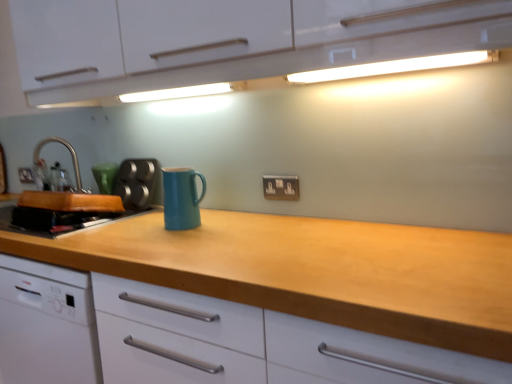
Measure the distance between matte silver electric outlet at center and camera.

4.98 feet.

What is the approximate height of brushed metal tap at left?

brushed metal tap at left is 29.10 centimeters tall.

Image resolution: width=512 pixels, height=384 pixels. Describe the element at coordinates (136, 182) in the screenshot. I see `metallic silver muffin tin at left` at that location.

This screenshot has height=384, width=512. I want to click on white glossy cabinet at upper center, so click(233, 41).

Considering the positions of objects teal matte mug at center, which is the 1th kitchen appliance in front-to-back order, and wooden at center in the image provided, who is more to the left, teal matte mug at center, which is the 1th kitchen appliance in front-to-back order, or wooden at center?

teal matte mug at center, which is the 1th kitchen appliance in front-to-back order.

Is teal matte mug at center, the second kitchen appliance in the left-to-right sequence, aimed at wooden at center?

No, teal matte mug at center, the second kitchen appliance in the left-to-right sequence, is not aimed at wooden at center.

Is teal matte mug at center, placed as the 1th kitchen appliance when sorted from right to left, in contact with wooden at center?

There is a gap between teal matte mug at center, placed as the 1th kitchen appliance when sorted from right to left, and wooden at center.

Based on the photo, from the image's perspective, is teal matte mug at center, the second kitchen appliance in the left-to-right sequence, located above wooden at center?

Yes, from the image's perspective, teal matte mug at center, the second kitchen appliance in the left-to-right sequence, is over wooden at center.

Is metallic silver muffin tin at left positioned in front of white glossy cabinet at upper center?

No, metallic silver muffin tin at left is further to the viewer.

Where is `cabinetry in front of the metallic silver muffin tin at left`? The height and width of the screenshot is (384, 512). cabinetry in front of the metallic silver muffin tin at left is located at coordinates (233, 41).

Can you tell me how much metallic silver muffin tin at left and white glossy cabinet at upper center differ in facing direction?

The facing directions of metallic silver muffin tin at left and white glossy cabinet at upper center are 3.81 degrees apart.

Which is more to the right, metallic silver muffin tin at left or white glossy cabinet at upper center?

From the viewer's perspective, white glossy cabinet at upper center appears more on the right side.

From their relative heights in the image, would you say white glossy cabinet at upper center is taller or shorter than matte silver electric outlet at center?

white glossy cabinet at upper center is taller than matte silver electric outlet at center.

Is matte silver electric outlet at center at the back of white glossy cabinet at upper center?

No, matte silver electric outlet at center is not at the back of white glossy cabinet at upper center.

Locate an element on the screen. cabinetry above the matte silver electric outlet at center (from the image's perspective) is located at coordinates (233, 41).

How many degrees apart are the facing directions of white glossy cabinet at upper center and matte silver electric outlet at center?

They differ by 1.4 degrees in their facing directions.

Could you tell me if wooden cutting board at left, the first kitchen appliance positioned from the back, is turned towards metallic silver muffin tin at left?

No, wooden cutting board at left, the first kitchen appliance positioned from the back, does not turn towards metallic silver muffin tin at left.

Is wooden cutting board at left, which ranks as the 1th kitchen appliance in left-to-right order, bigger or smaller than metallic silver muffin tin at left?

Clearly, wooden cutting board at left, which ranks as the 1th kitchen appliance in left-to-right order, is larger in size than metallic silver muffin tin at left.

From the picture: Looking at their sizes, would you say wooden cutting board at left, the first kitchen appliance positioned from the back, is wider or thinner than metallic silver muffin tin at left?

Clearly, wooden cutting board at left, the first kitchen appliance positioned from the back, has more width compared to metallic silver muffin tin at left.

From a real-world perspective, is wooden cutting board at left, which ranks as the 2th kitchen appliance in right-to-left order, beneath metallic silver muffin tin at left?

Yes.

Does wooden cutting board at left, which ranks as the 1th kitchen appliance in left-to-right order, appear on the right side of teal matte mug at center, the second kitchen appliance in the left-to-right sequence?

In fact, wooden cutting board at left, which ranks as the 1th kitchen appliance in left-to-right order, is to the left of teal matte mug at center, the second kitchen appliance in the left-to-right sequence.

Which is in front, point (84, 227) or point (187, 168)?

The point (84, 227) is more forward.

Between wooden cutting board at left, which ranks as the 1th kitchen appliance in left-to-right order, and teal matte mug at center, the second kitchen appliance in the left-to-right sequence, which one has smaller width?

With smaller width is teal matte mug at center, the second kitchen appliance in the left-to-right sequence.

How distant is wooden cutting board at left, which ranks as the 1th kitchen appliance in left-to-right order, from teal matte mug at center, which ranks as the second kitchen appliance in back-to-front order?

18.51 inches.

Is brushed metal tap at left oriented towards teal matte mug at center, which is the 1th kitchen appliance in front-to-back order?

No, brushed metal tap at left is not facing towards teal matte mug at center, which is the 1th kitchen appliance in front-to-back order.

Considering their positions, is brushed metal tap at left located in front of or behind teal matte mug at center, the second kitchen appliance in the left-to-right sequence?

Clearly, brushed metal tap at left is behind teal matte mug at center, the second kitchen appliance in the left-to-right sequence.

From a real-world perspective, is brushed metal tap at left physically below teal matte mug at center, which is the 1th kitchen appliance in front-to-back order?

No, from a real-world perspective, brushed metal tap at left is not under teal matte mug at center, which is the 1th kitchen appliance in front-to-back order.

From the image's perspective, which is below, matte silver electric outlet at center or wooden cutting board at left, which ranks as the 2th kitchen appliance in right-to-left order?

wooden cutting board at left, which ranks as the 2th kitchen appliance in right-to-left order, from the image's perspective.

Is matte silver electric outlet at center thinner than wooden cutting board at left, the second kitchen appliance when ordered from front to back?

Correct, the width of matte silver electric outlet at center is less than that of wooden cutting board at left, the second kitchen appliance when ordered from front to back.

Is point (276, 195) farther from viewer compared to point (110, 211)?

No, (276, 195) is closer to viewer.

Locate an element on the screen. The image size is (512, 384). the 1st kitchen appliance to the left of the wooden at center, counting from the anchor's position is located at coordinates pyautogui.click(x=181, y=198).

Locate an element on the screen. appliance behind the white glossy cabinet at upper center is located at coordinates (136, 182).

Considering their positions, is white glossy cabinet at upper center positioned closer to brushed metal tap at left than metallic silver muffin tin at left?

metallic silver muffin tin at left lies closer to brushed metal tap at left than the other object.

Considering their positions, is white glossy cabinet at upper center positioned further to wooden at center than brushed metal tap at left?

brushed metal tap at left lies further to wooden at center than the other object.

From the image, which object appears to be nearer to wooden at center, wooden cutting board at left, which ranks as the 2th kitchen appliance in right-to-left order, or metallic silver muffin tin at left?

wooden cutting board at left, which ranks as the 2th kitchen appliance in right-to-left order, lies closer to wooden at center than the other object.

When comparing their distances from white glossy cabinet at upper center, does wooden at center or matte silver electric outlet at center seem further?

The object further to white glossy cabinet at upper center is matte silver electric outlet at center.

Consider the image. Considering their positions, is metallic silver muffin tin at left positioned closer to white glossy cabinet at upper center than matte silver electric outlet at center?

metallic silver muffin tin at left lies closer to white glossy cabinet at upper center than the other object.

Estimate the real-world distances between objects in this image. Which object is further from teal matte mug at center, placed as the 1th kitchen appliance when sorted from right to left, wooden cutting board at left, which ranks as the 2th kitchen appliance in right-to-left order, or white glossy cabinet at upper center?

Based on the image, white glossy cabinet at upper center appears to be further to teal matte mug at center, placed as the 1th kitchen appliance when sorted from right to left.

From the image, which object appears to be farther from metallic silver muffin tin at left, wooden cutting board at left, which ranks as the 1th kitchen appliance in left-to-right order, or teal matte mug at center, placed as the 1th kitchen appliance when sorted from right to left?

Among the two, teal matte mug at center, placed as the 1th kitchen appliance when sorted from right to left, is located further to metallic silver muffin tin at left.

Considering their positions, is teal matte mug at center, which ranks as the second kitchen appliance in back-to-front order, positioned closer to wooden at center than brushed metal tap at left?

teal matte mug at center, which ranks as the second kitchen appliance in back-to-front order, is closer to wooden at center.

The height and width of the screenshot is (384, 512). What are the coordinates of `electric outlet between wooden at center and metallic silver muffin tin at left in the front-back direction` in the screenshot? It's located at (281, 187).

Image resolution: width=512 pixels, height=384 pixels. In order to click on electric outlet positioned between white glossy cabinet at upper center and brushed metal tap at left from near to far in this screenshot , I will do `click(281, 187)`.

Locate an element on the screen. The image size is (512, 384). kitchen appliance between wooden at center and wooden cutting board at left, the first kitchen appliance positioned from the back, along the z-axis is located at coordinates (181, 198).

This screenshot has height=384, width=512. Find the location of `electric outlet between wooden at center and brushed metal tap at left along the z-axis`. electric outlet between wooden at center and brushed metal tap at left along the z-axis is located at coordinates (281, 187).